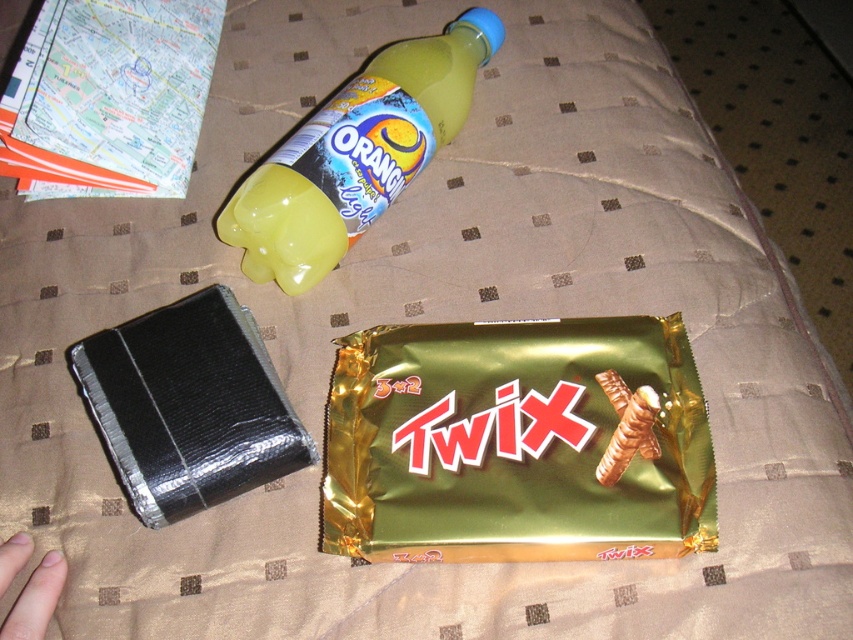
Question: Estimate the real-world distances between objects in this image. Which object is farther from the black foil-wrapped chocolate bar at lower left?

Choices:
 (A) green shiny chocolate bar at center
 (B) yellow translucent plastic bottle at upper center

Answer: (B)

Question: Which point is farther from the camera taking this photo?

Choices:
 (A) (289, 148)
 (B) (410, 481)
 (C) (132, 451)

Answer: (A)

Question: Does black foil-wrapped chocolate bar at lower left have a larger size compared to yellow translucent plastic bottle at upper center?

Choices:
 (A) yes
 (B) no

Answer: (B)

Question: Which of the following is the closest to the observer?

Choices:
 (A) (373, 156)
 (B) (329, 522)
 (C) (299, 467)

Answer: (B)

Question: Is green shiny chocolate bar at center to the right of yellow translucent plastic bottle at upper center from the viewer's perspective?

Choices:
 (A) no
 (B) yes

Answer: (B)

Question: Is green shiny chocolate bar at center bigger than yellow translucent plastic bottle at upper center?

Choices:
 (A) yes
 (B) no

Answer: (B)